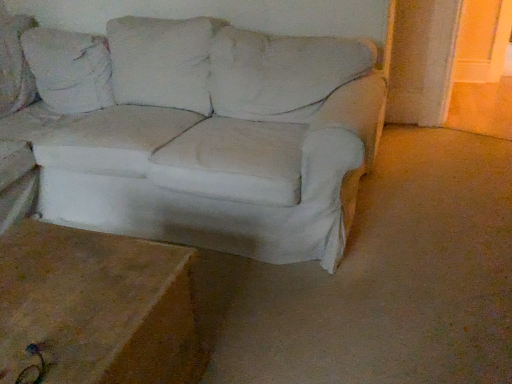
Question: In terms of height, does white fabric couch at center look taller or shorter compared to brown wood table at lower left?

Choices:
 (A) tall
 (B) short

Answer: (A)

Question: From a real-world perspective, is white fabric couch at center above or below brown wood table at lower left?

Choices:
 (A) above
 (B) below

Answer: (A)

Question: In the image, is white fabric couch at center on the left side or the right side of brown wood table at lower left?

Choices:
 (A) right
 (B) left

Answer: (A)

Question: Is point (94, 235) closer or farther from the camera than point (231, 114)?

Choices:
 (A) farther
 (B) closer

Answer: (B)

Question: Is brown wood table at lower left taller or shorter than white fabric couch at center?

Choices:
 (A) tall
 (B) short

Answer: (B)

Question: Considering the positions of brown wood table at lower left and white fabric couch at center in the image, is brown wood table at lower left wider or thinner than white fabric couch at center?

Choices:
 (A) wide
 (B) thin

Answer: (B)

Question: From a real-world perspective, is brown wood table at lower left positioned above or below white fabric couch at center?

Choices:
 (A) below
 (B) above

Answer: (A)